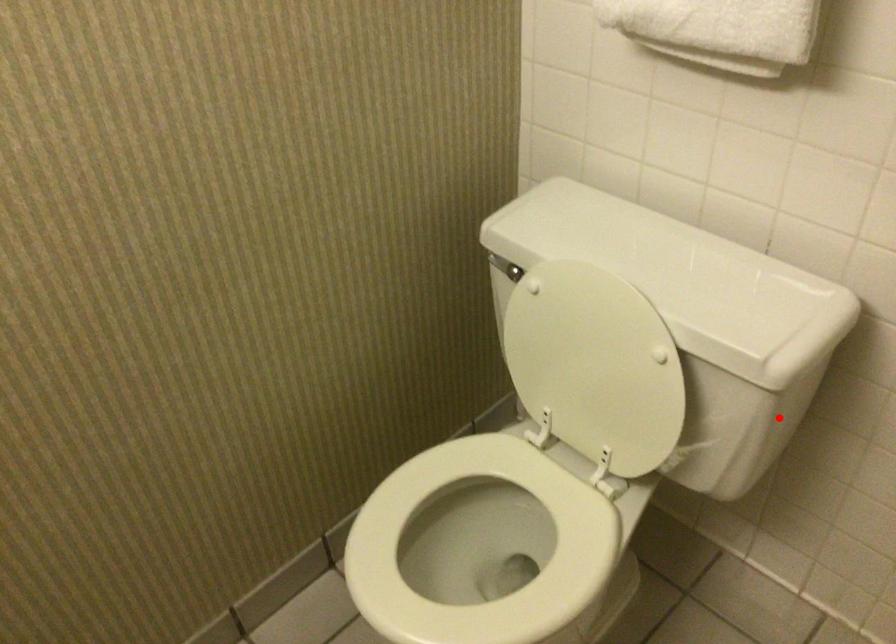
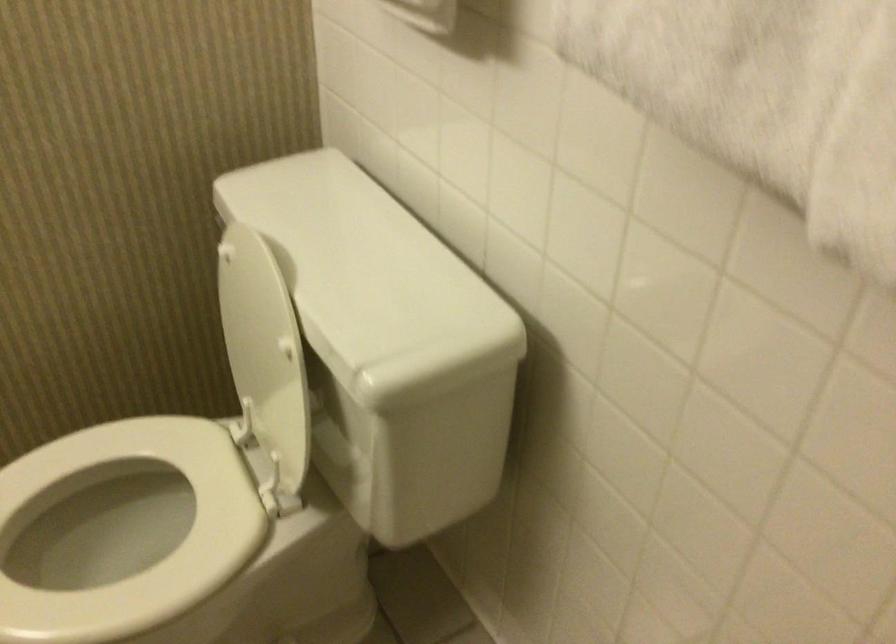
In the second image, find the point that corresponds to the highlighted location in the first image.

(411, 451)